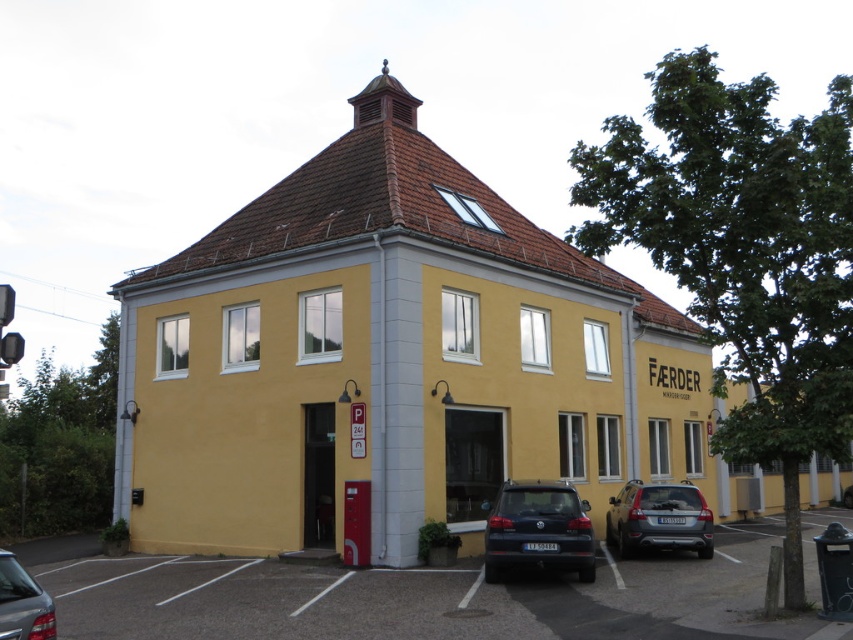
You are a delivery driver who needs to park your matte black car at lower center in the gray asphalt parking lot at lower center. Can you fit your car into the parking space provided?

The gray asphalt parking lot at lower center is larger in size than the matte black car at lower center, so yes, the matte black car at lower center can fit into the parking space provided.

From the picture: You are standing at a point 53.14 feet away from the building. If you want to enter the building through the entrance on the ground floor, which direction should you move relative to the point marked at coordinate point (622, 544)?

The point marked at coordinate point (622, 544) is 53.14 feet away from the viewer. To enter the building through the entrance on the ground floor, you should move towards the building from the point marked at coordinate point (622, 544).

You are a delivery person trying to park your delivery van between the satin silver suv at lower right and the shiny silver sedan at lower left. Can you fit your van, which is 6 meters long, in the available space between them?

The satin silver suv at lower right is bigger than the shiny silver sedan at lower left, but the distance between them isn